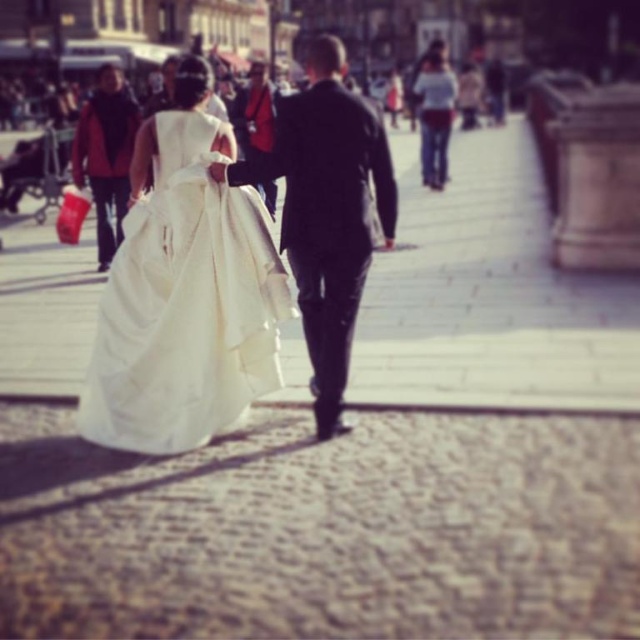
From the picture: What are the coordinates of the ivory satin dress at center in the image?

The ivory satin dress at center is located at coordinates point (186, 305).

You are a photographer who wants to capture the couple in the center of the image. The ivory satin dress at center is represented by point (186, 305). Where should you focus your camera to ensure the ivory satin dress at center is in sharp focus?

The ivory satin dress at center is represented by point (186, 305), so you should focus your camera at point (186, 305) to ensure the ivory satin dress at center is in sharp focus.

You are standing in the cobblestone street and want to walk towards the point that is closer to you. Which point should you walk towards, point (170, 396) or point (372, 168)?

You should walk towards point (170, 396) because it is closer to the viewer than point (372, 168).